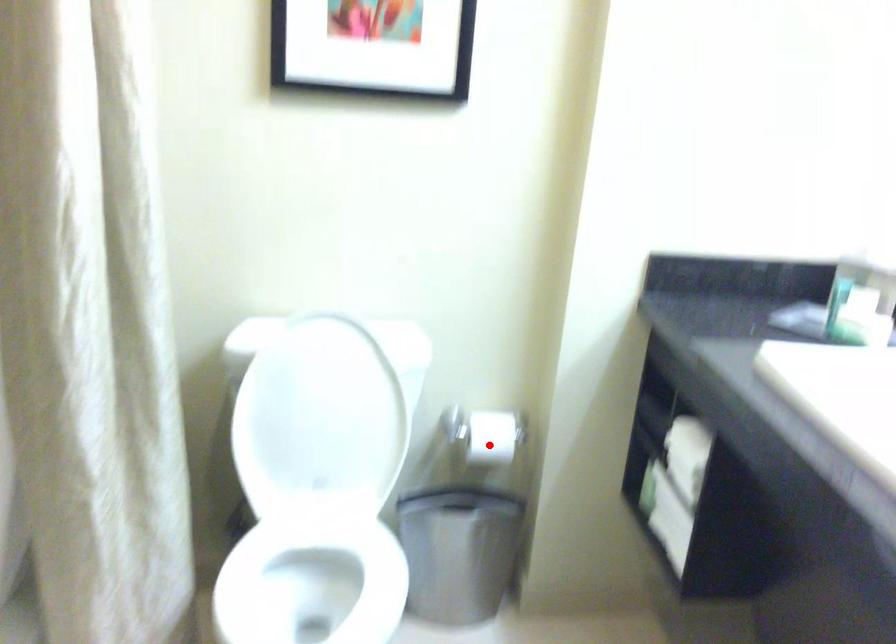
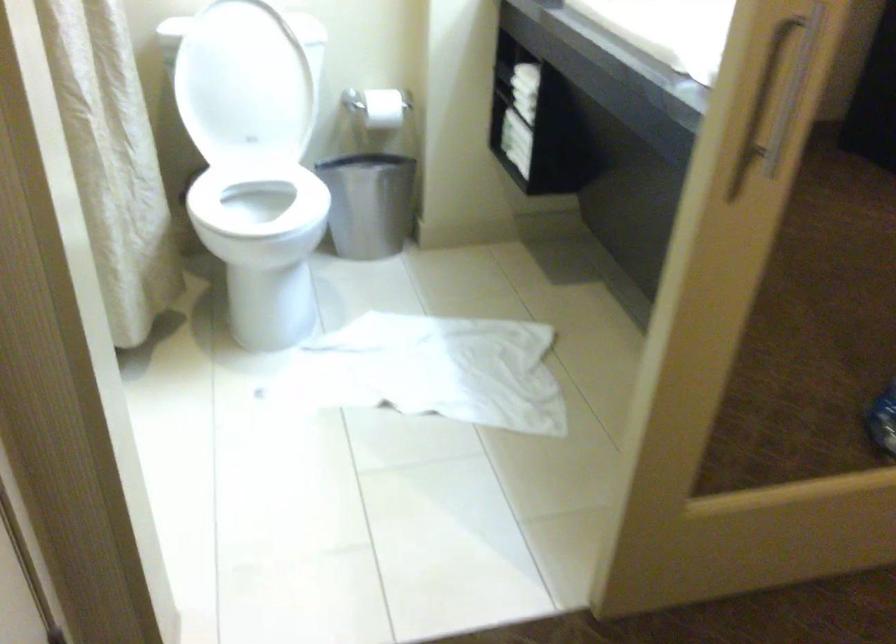
Question: I am providing you with two images of the same scene from different viewpoints. Image1 has a red point marked. In image2, the corresponding 3D location appears at what relative position? Reply with the corresponding letter.

Choices:
 (A) Closer
 (B) Farther

Answer: (B)